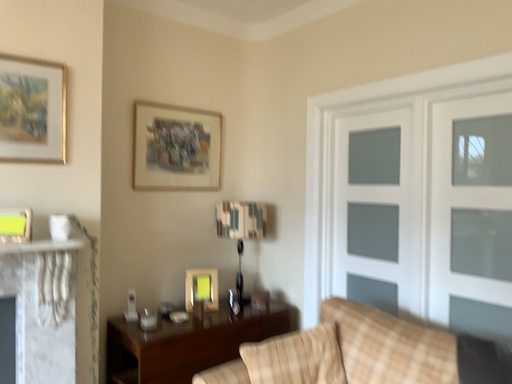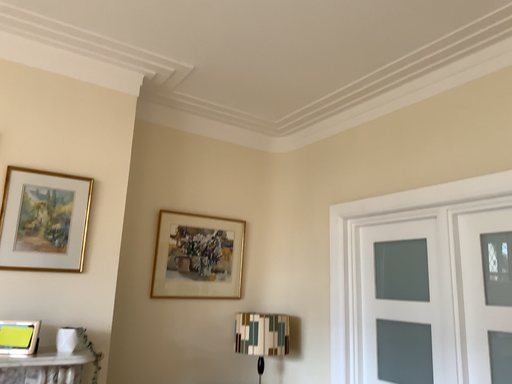
Question: How did the camera likely rotate when shooting the video?

Choices:
 (A) rotated downward
 (B) rotated upward

Answer: (B)